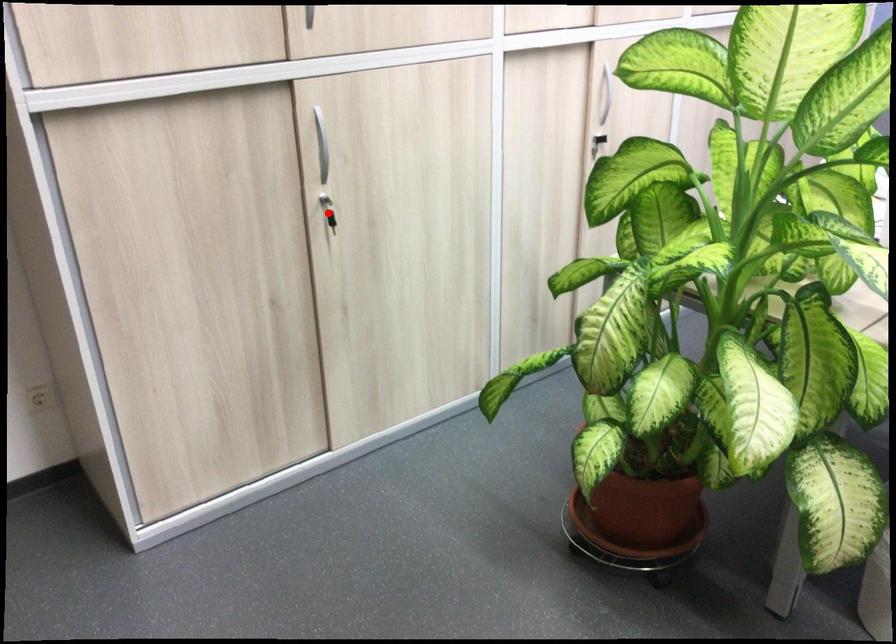
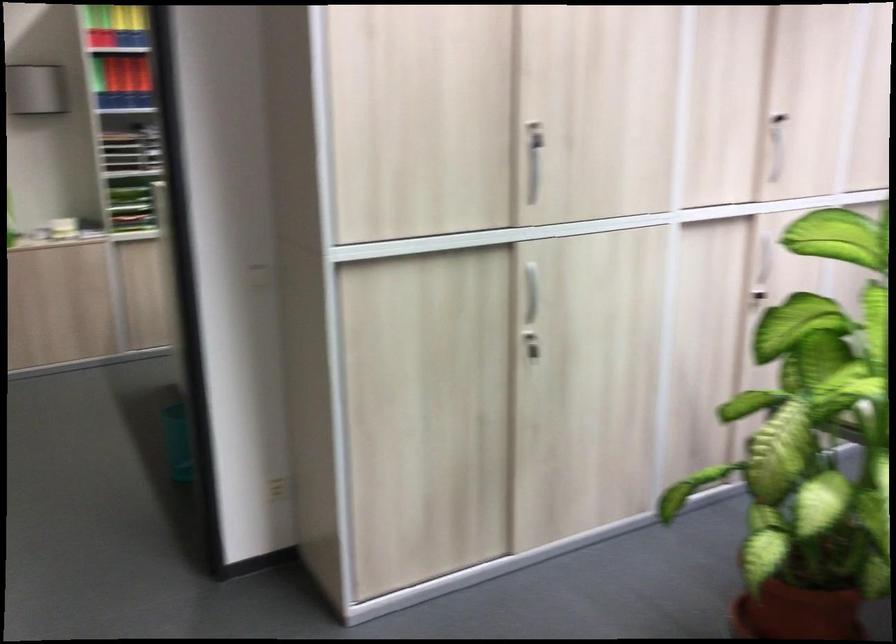
Question: A red point is marked in image1. In image2, is the corresponding 3D point closer to the camera or farther? Reply with the corresponding letter.

Choices:
 (A) The corresponding 3D point is closer.
 (B) The corresponding 3D point is farther.

Answer: (B)